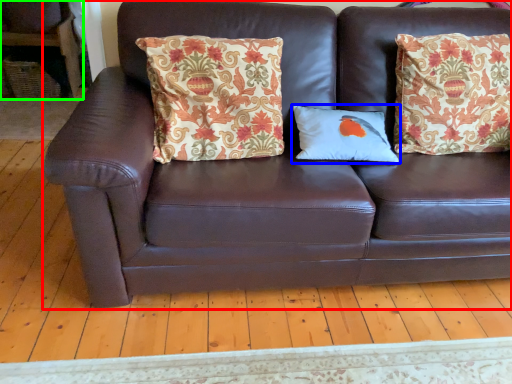
Question: Estimate the real-world distances between objects in this image. Which object is closer to studio couch (highlighted by a red box), pillow (highlighted by a blue box) or armchair (highlighted by a green box)?

Choices:
 (A) pillow
 (B) armchair

Answer: (A)